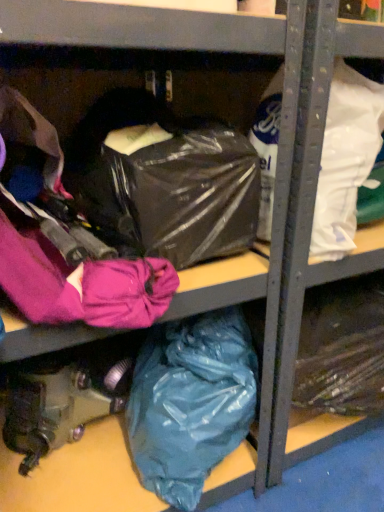
Question: Is point (153, 146) closer or farther from the camera than point (163, 395)?

Choices:
 (A) closer
 (B) farther

Answer: (A)

Question: Is transparent plastic bag at center taller or shorter than teal matte plastic bag at lower center, which is counted as the first plastic bag, starting from the bottom?

Choices:
 (A) short
 (B) tall

Answer: (A)

Question: Which of these objects is positioned farthest from the teal matte plastic bag at lower center, which is counted as the first plastic bag, starting from the bottom?

Choices:
 (A) white matte plastic bag at upper right, the first plastic bag in the top-to-bottom sequence
 (B) transparent plastic bag at center

Answer: (A)

Question: Considering the real-world distances, which object is farthest from the transparent plastic bag at center?

Choices:
 (A) white matte plastic bag at upper right, which ranks as the 2th plastic bag in bottom-to-top order
 (B) teal matte plastic bag at lower center, which is counted as the first plastic bag, starting from the bottom

Answer: (B)